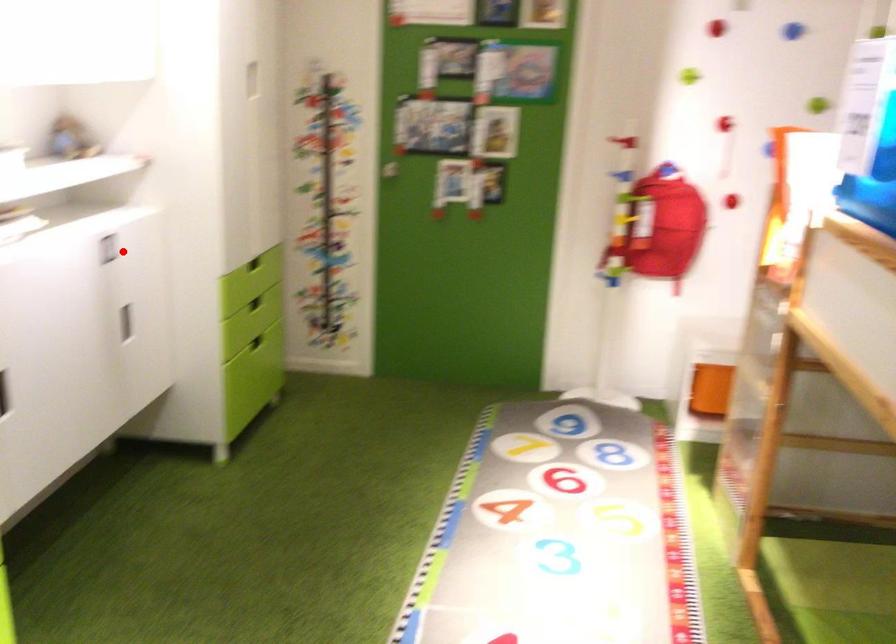
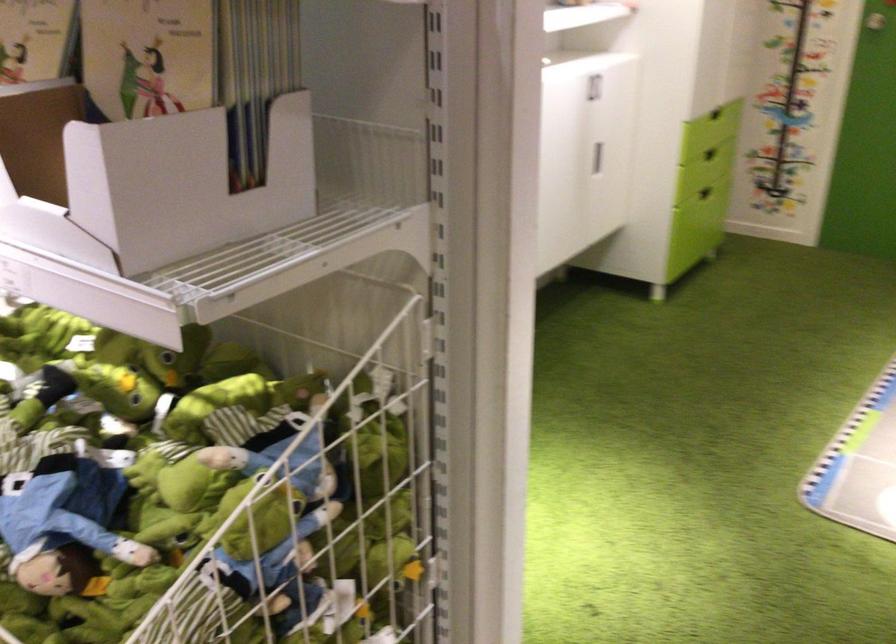
Find the pixel in the second image that matches the highlighted location in the first image.

(593, 87)